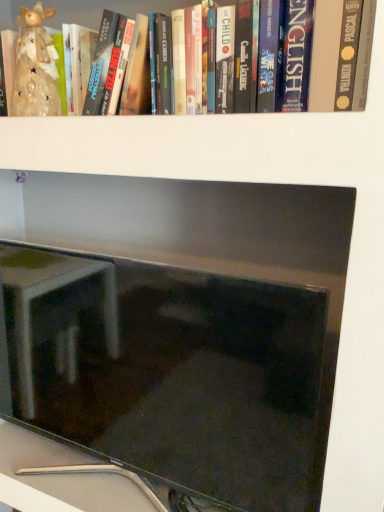
Question: Is matte black monitor at center far away from hardcover book at upper center?

Choices:
 (A) yes
 (B) no

Answer: (B)

Question: From the image's perspective, does matte black monitor at center appear lower than hardcover book at upper center?

Choices:
 (A) yes
 (B) no

Answer: (A)

Question: From a real-world perspective, is matte black monitor at center below hardcover book at upper center?

Choices:
 (A) yes
 (B) no

Answer: (A)

Question: Is hardcover book at upper center a part of matte black monitor at center?

Choices:
 (A) no
 (B) yes

Answer: (A)

Question: Does matte black monitor at center have a lesser width compared to hardcover book at upper center?

Choices:
 (A) yes
 (B) no

Answer: (A)

Question: Looking at the image, does matte black monitor at center seem bigger or smaller compared to hardcover book at upper center?

Choices:
 (A) big
 (B) small

Answer: (A)

Question: From their relative heights in the image, would you say matte black monitor at center is taller or shorter than hardcover book at upper center?

Choices:
 (A) short
 (B) tall

Answer: (B)

Question: Considering the relative positions of matte black monitor at center and hardcover book at upper center in the image provided, is matte black monitor at center to the left or to the right of hardcover book at upper center?

Choices:
 (A) right
 (B) left

Answer: (B)

Question: From the image's perspective, relative to hardcover book at upper center, is matte black monitor at center above or below?

Choices:
 (A) below
 (B) above

Answer: (A)

Question: Is matte ceramic figurine at upper left spatially inside hardcover book at upper center, or outside of it?

Choices:
 (A) inside
 (B) outside

Answer: (A)

Question: From a real-world perspective, is matte ceramic figurine at upper left physically located above or below hardcover book at upper center?

Choices:
 (A) above
 (B) below

Answer: (B)

Question: Is point (23, 47) closer or farther from the camera than point (334, 6)?

Choices:
 (A) closer
 (B) farther

Answer: (B)

Question: In terms of width, does matte ceramic figurine at upper left look wider or thinner when compared to hardcover book at upper center?

Choices:
 (A) thin
 (B) wide

Answer: (A)

Question: Is hardcover book at upper center situated inside matte black monitor at center or outside?

Choices:
 (A) outside
 (B) inside

Answer: (A)

Question: Looking at their shapes, would you say hardcover book at upper center is wider or thinner than matte black monitor at center?

Choices:
 (A) thin
 (B) wide

Answer: (B)